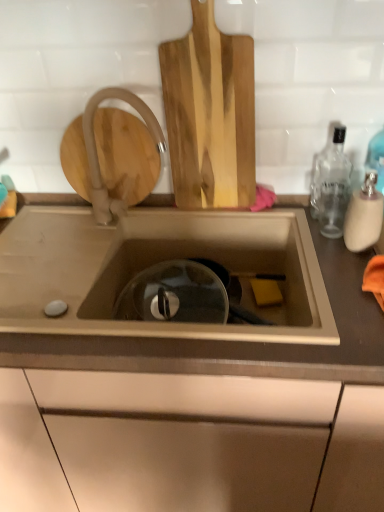
This screenshot has width=384, height=512. What do you see at coordinates (331, 187) in the screenshot?
I see `clear glass bottle at right, acting as the 2th bottle starting from the front` at bounding box center [331, 187].

What is the approximate width of matte brown countertop at center?

matte brown countertop at center is 60.02 centimeters in width.

The width and height of the screenshot is (384, 512). I want to click on translucent glass bottle at right, which ranks as the first bottle in front-to-back order, so click(364, 215).

The image size is (384, 512). What are the coordinates of `clear glass bottle at right, acting as the 2th bottle starting from the front` in the screenshot? It's located at (331, 187).

From a real-world perspective, does translucent glass bottle at right, which ranks as the first bottle in front-to-back order, stand above matte white faucet at upper left?

Actually, translucent glass bottle at right, which ranks as the first bottle in front-to-back order, is physically below matte white faucet at upper left in the real world.

Considering the points (366, 190) and (88, 106), which point is behind, point (366, 190) or point (88, 106)?

Positioned behind is point (88, 106).

Who is taller, translucent glass bottle at right, which appears as the second bottle when viewed from the back, or matte white faucet at upper left?

With more height is matte white faucet at upper left.

Looking at this image, is translucent glass bottle at right, which appears as the second bottle when viewed from the back, next to matte white faucet at upper left?

No.

From a real-world perspective, relative to matte brown countertop at center, is translucent glass bottle at right, which ranks as the first bottle in front-to-back order, vertically above or below?

translucent glass bottle at right, which ranks as the first bottle in front-to-back order, is situated higher than matte brown countertop at center in the real world.

Between translucent glass bottle at right, which appears as the second bottle when viewed from the back, and matte brown countertop at center, which one is positioned in front?

matte brown countertop at center is in front.

Would you say translucent glass bottle at right, which ranks as the first bottle in front-to-back order, is part of natural wood cutting board at upper center's contents?

No, translucent glass bottle at right, which ranks as the first bottle in front-to-back order, is located outside of natural wood cutting board at upper center.

Would you consider natural wood cutting board at upper center to be distant from translucent glass bottle at right, which appears as the second bottle when viewed from the back?

No, natural wood cutting board at upper center is in close proximity to translucent glass bottle at right, which appears as the second bottle when viewed from the back.

From a real-world perspective, is natural wood cutting board at upper center located beneath translucent glass bottle at right, which appears as the second bottle when viewed from the back?

No, from a real-world perspective, natural wood cutting board at upper center is not beneath translucent glass bottle at right, which appears as the second bottle when viewed from the back.

Can you confirm if natural wood cutting board at upper center is wider than translucent glass bottle at right, which ranks as the first bottle in front-to-back order?

Incorrect, the width of natural wood cutting board at upper center does not surpass that of translucent glass bottle at right, which ranks as the first bottle in front-to-back order.

Is there a large distance between translucent glass bottle at right, which appears as the second bottle when viewed from the back, and natural wood cutting board at upper center?

No, translucent glass bottle at right, which appears as the second bottle when viewed from the back, is not far away from natural wood cutting board at upper center.

From the picture: Between translucent glass bottle at right, which ranks as the first bottle in front-to-back order, and natural wood cutting board at upper center, which one has larger width?

translucent glass bottle at right, which ranks as the first bottle in front-to-back order, is wider.

Where is `cutting board behind the translucent glass bottle at right, which ranks as the first bottle in front-to-back order`? The image size is (384, 512). cutting board behind the translucent glass bottle at right, which ranks as the first bottle in front-to-back order is located at coordinates (210, 114).

Would you say matte brown countertop at center is to the left or to the right of matte white faucet at upper left in the picture?

matte brown countertop at center is positioned on matte white faucet at upper left's right side.

Who is smaller, matte brown countertop at center or matte white faucet at upper left?

With smaller size is matte white faucet at upper left.

From the image's perspective, does matte brown countertop at center appear higher than matte white faucet at upper left?

Actually, matte brown countertop at center appears below matte white faucet at upper left in the image.

The height and width of the screenshot is (512, 384). In order to click on tap located above the matte brown countertop at center (from a real-world perspective) in this screenshot , I will do `click(96, 149)`.

At what (x,y) coordinates should I click in order to perform the action: click on bottle located behind the natural wood cutting board at upper center. Please return your answer as a coordinate pair (x, y). The width and height of the screenshot is (384, 512). Looking at the image, I should click on (331, 187).

Could you tell me if natural wood cutting board at upper center is facing clear glass bottle at right, the 1th bottle in the back-to-front sequence?

No, natural wood cutting board at upper center is not oriented towards clear glass bottle at right, the 1th bottle in the back-to-front sequence.

Between point (248, 61) and point (328, 166), which one is positioned in front?

The point (248, 61) is closer to the camera.

Which of these two, natural wood cutting board at upper center or matte brown countertop at center, is bigger?

Bigger between the two is matte brown countertop at center.

Based on the photo, which point is more forward, (200,128) or (321,252)?

Positioned in front is point (321,252).

From the picture: Is natural wood cutting board at upper center facing towards matte brown countertop at center?

No, natural wood cutting board at upper center is not facing towards matte brown countertop at center.

This screenshot has width=384, height=512. What are the coordinates of `tap above the translucent glass bottle at right, which ranks as the first bottle in front-to-back order (from a real-world perspective)` in the screenshot? It's located at (96, 149).

Image resolution: width=384 pixels, height=512 pixels. In the image, there is a translucent glass bottle at right, which ranks as the first bottle in front-to-back order. Identify the location of countertop below it (from a real-world perspective). (200, 415).

From the image, which object appears to be nearer to matte brown countertop at center, clear glass bottle at right, acting as the 2th bottle starting from the front, or matte white faucet at upper left?

Among the two, matte white faucet at upper left is located nearer to matte brown countertop at center.

Looking at the image, which one is located closer to translucent glass bottle at right, which appears as the second bottle when viewed from the back, clear glass bottle at right, acting as the 2th bottle starting from the front, or matte brown countertop at center?

clear glass bottle at right, acting as the 2th bottle starting from the front.

Estimate the real-world distances between objects in this image. Which object is further from matte brown countertop at center, translucent glass bottle at right, which ranks as the first bottle in front-to-back order, or natural wood cutting board at upper center?

translucent glass bottle at right, which ranks as the first bottle in front-to-back order, is positioned further to the anchor matte brown countertop at center.

From the image, which object appears to be nearer to matte brown countertop at center, translucent glass bottle at right, which appears as the second bottle when viewed from the back, or clear glass bottle at right, the 1th bottle in the back-to-front sequence?

Based on the image, clear glass bottle at right, the 1th bottle in the back-to-front sequence, appears to be nearer to matte brown countertop at center.

From the image, which object appears to be farther from matte brown countertop at center, clear glass bottle at right, acting as the 2th bottle starting from the front, or translucent glass bottle at right, which ranks as the first bottle in front-to-back order?

translucent glass bottle at right, which ranks as the first bottle in front-to-back order.

Considering their positions, is natural wood cutting board at upper center positioned further to translucent glass bottle at right, which appears as the second bottle when viewed from the back, than clear glass bottle at right, acting as the 2th bottle starting from the front?

Among the two, natural wood cutting board at upper center is located further to translucent glass bottle at right, which appears as the second bottle when viewed from the back.

Which object lies nearer to the anchor point matte white faucet at upper left, matte brown countertop at center or translucent glass bottle at right, which ranks as the first bottle in front-to-back order?

matte brown countertop at center.

Looking at the image, which one is located closer to clear glass bottle at right, the 1th bottle in the back-to-front sequence, translucent glass bottle at right, which ranks as the first bottle in front-to-back order, or natural wood cutting board at upper center?

Based on the image, translucent glass bottle at right, which ranks as the first bottle in front-to-back order, appears to be nearer to clear glass bottle at right, the 1th bottle in the back-to-front sequence.

Locate an element on the screen. cutting board between matte white faucet at upper left and translucent glass bottle at right, which ranks as the first bottle in front-to-back order, in the horizontal direction is located at coordinates click(210, 114).

Identify the location of bottle between clear glass bottle at right, the 1th bottle in the back-to-front sequence, and matte brown countertop at center in the up-down direction. The height and width of the screenshot is (512, 384). (364, 215).

The height and width of the screenshot is (512, 384). I want to click on bottle situated between matte white faucet at upper left and translucent glass bottle at right, which ranks as the first bottle in front-to-back order, from left to right, so click(331, 187).

The height and width of the screenshot is (512, 384). What are the coordinates of `bottle located between natural wood cutting board at upper center and translucent glass bottle at right, which ranks as the first bottle in front-to-back order, in the left-right direction` in the screenshot? It's located at (331, 187).